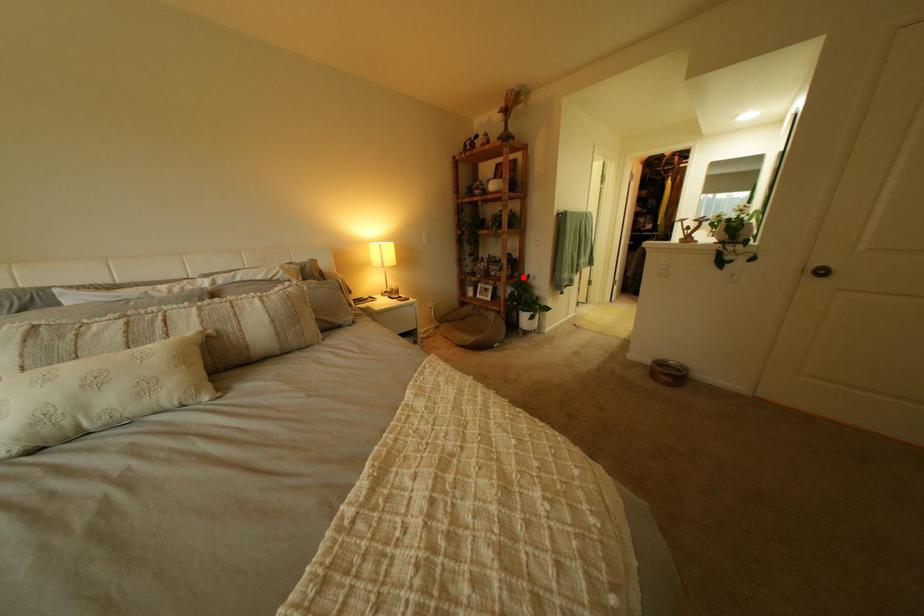
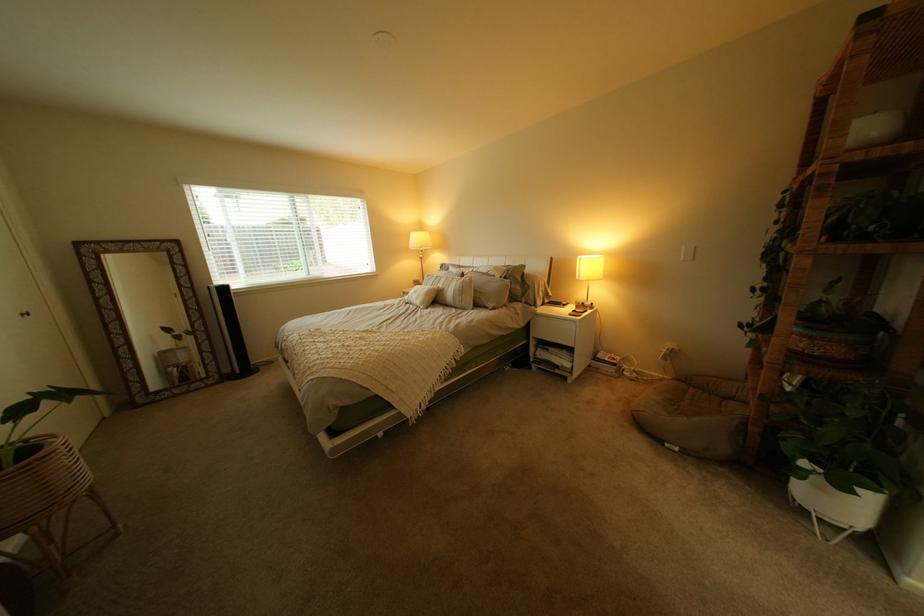
Locate, in the second image, the point that corresponds to the highlighted location in the first image.

(805, 354)